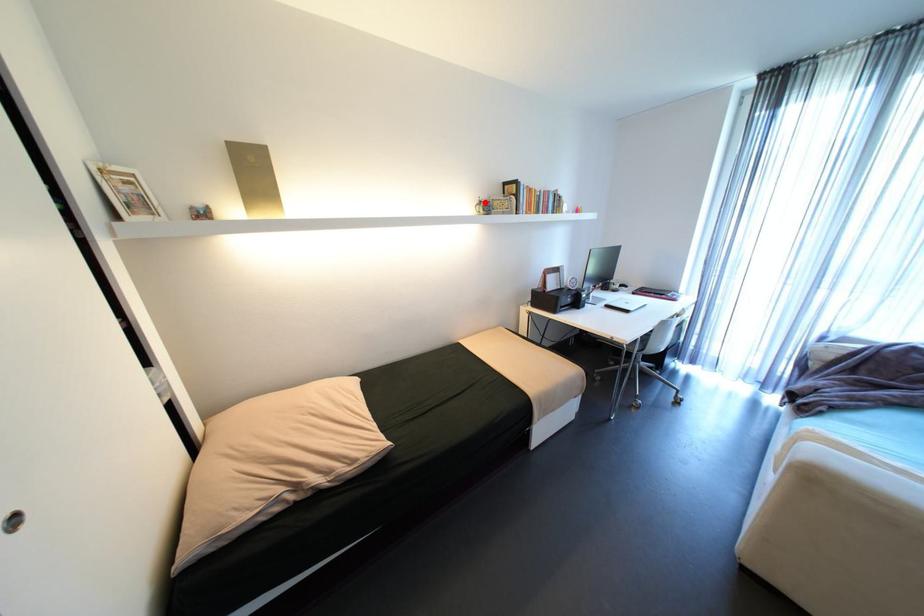
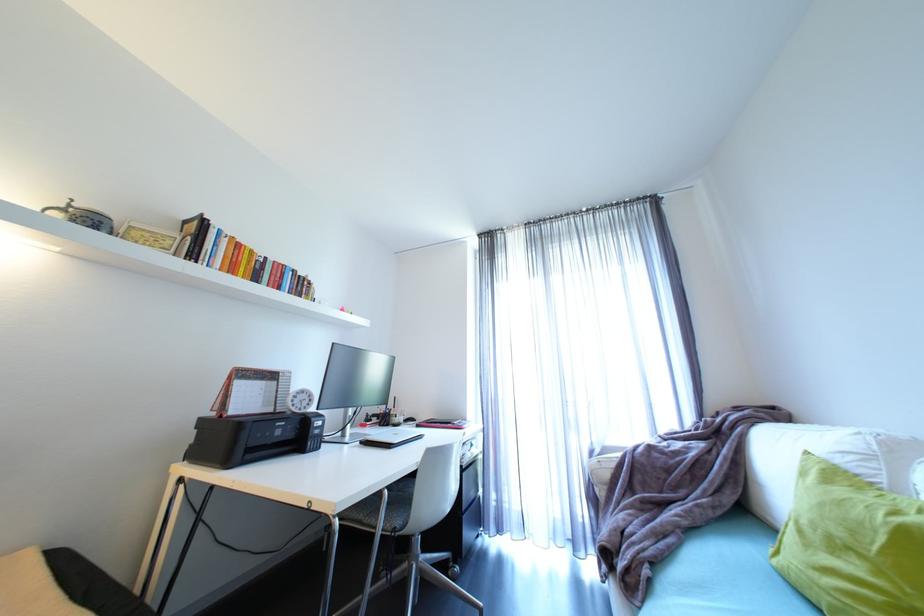
The point at the highlighted location is marked in the first image. Where is the corresponding point in the second image?

(69, 206)